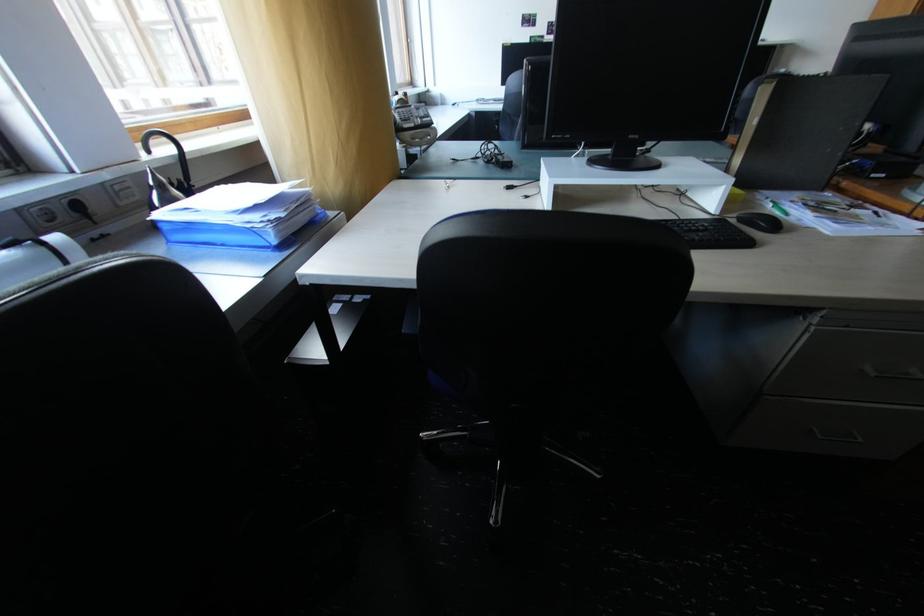
Where is `black binder`? The width and height of the screenshot is (924, 616). black binder is located at coordinates (800, 130).